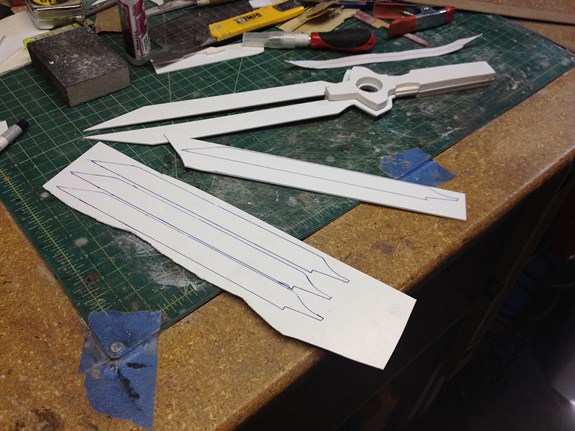
Locate an element on the screen. Image resolution: width=575 pixels, height=431 pixels. bottle is located at coordinates (134, 25).